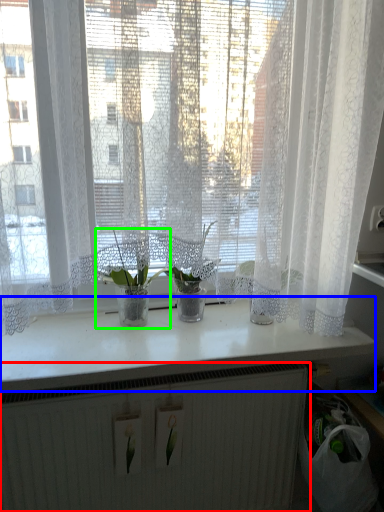
Question: Which object is positioned closest to radiator (highlighted by a red box)? Select from counter top (highlighted by a blue box) and houseplant (highlighted by a green box).

Choices:
 (A) counter top
 (B) houseplant

Answer: (A)